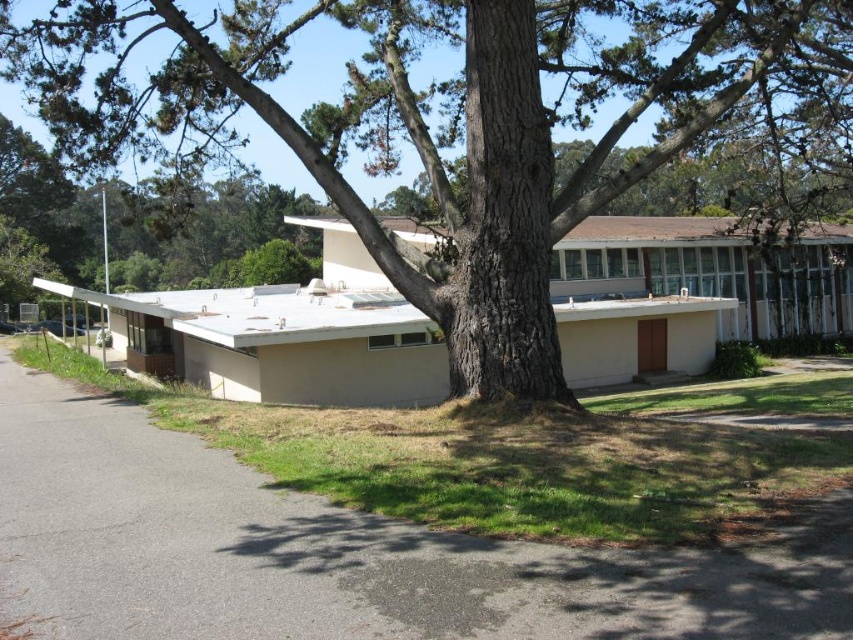
Question: Is brown rough tree at center closer to the viewer compared to gray asphalt driveway at lower left?

Choices:
 (A) no
 (B) yes

Answer: (A)

Question: Does brown rough tree at center lie in front of gray asphalt driveway at lower left?

Choices:
 (A) yes
 (B) no

Answer: (B)

Question: Observing the image, what is the correct spatial positioning of brown rough tree at center in reference to gray asphalt driveway at lower left?

Choices:
 (A) below
 (B) above

Answer: (B)

Question: Among these objects, which one is nearest to the camera?

Choices:
 (A) brown rough tree at center
 (B) gray asphalt driveway at lower left

Answer: (B)

Question: Which point appears farthest from the camera in this image?

Choices:
 (A) (229, 84)
 (B) (299, 515)

Answer: (A)